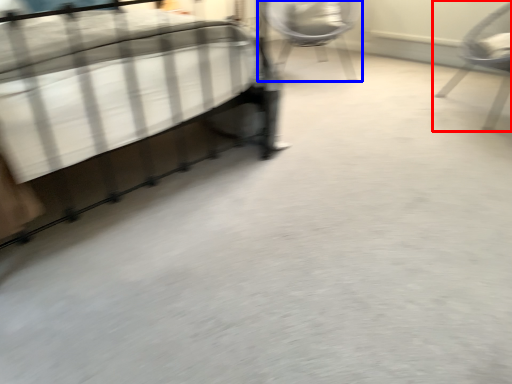
Question: Which object appears closest to the camera in this image, chair (highlighted by a red box) or chair (highlighted by a blue box)?

Choices:
 (A) chair
 (B) chair

Answer: (A)